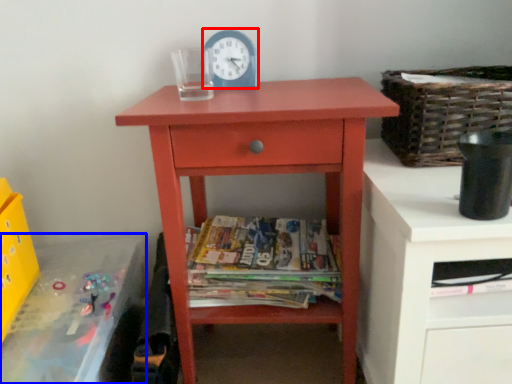
Question: Which object appears closest to the camera in this image, clock (highlighted by a red box) or changing table (highlighted by a blue box)?

Choices:
 (A) clock
 (B) changing table

Answer: (B)